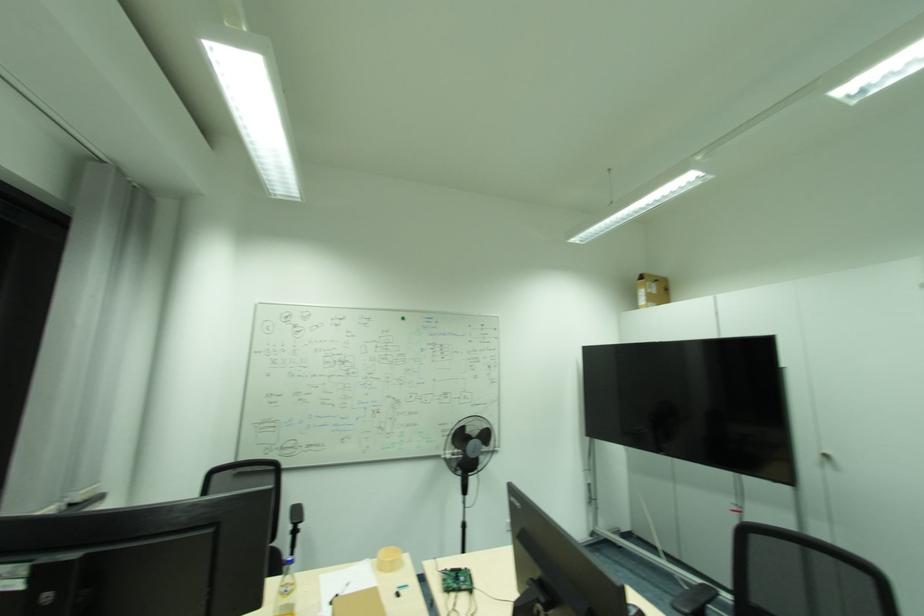
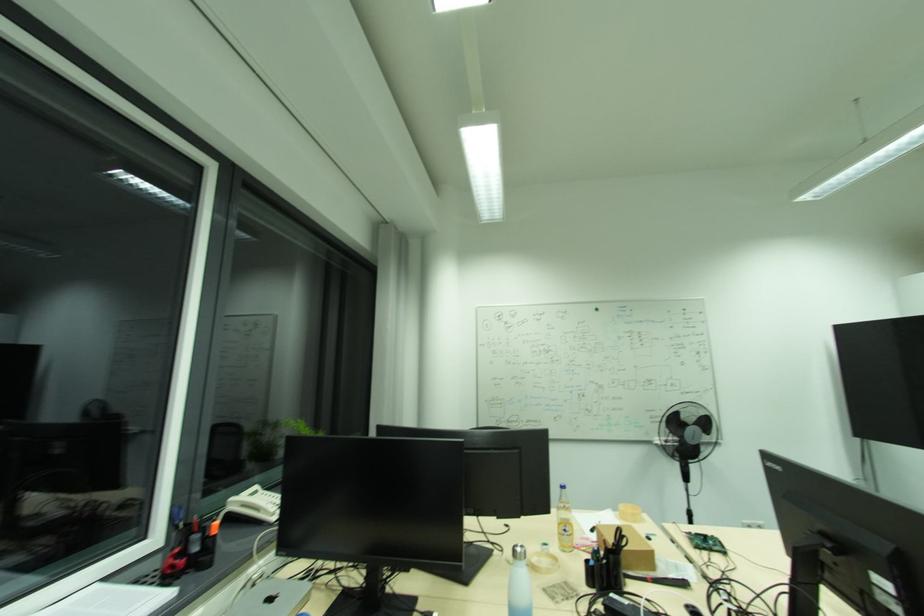
Question: The camera is either moving clockwise (left) or counter-clockwise (right) around the object. The first image is from the beginning of the video and the second image is from the end. Is the camera moving left or right when shooting the video?

Choices:
 (A) Left
 (B) Right

Answer: (B)